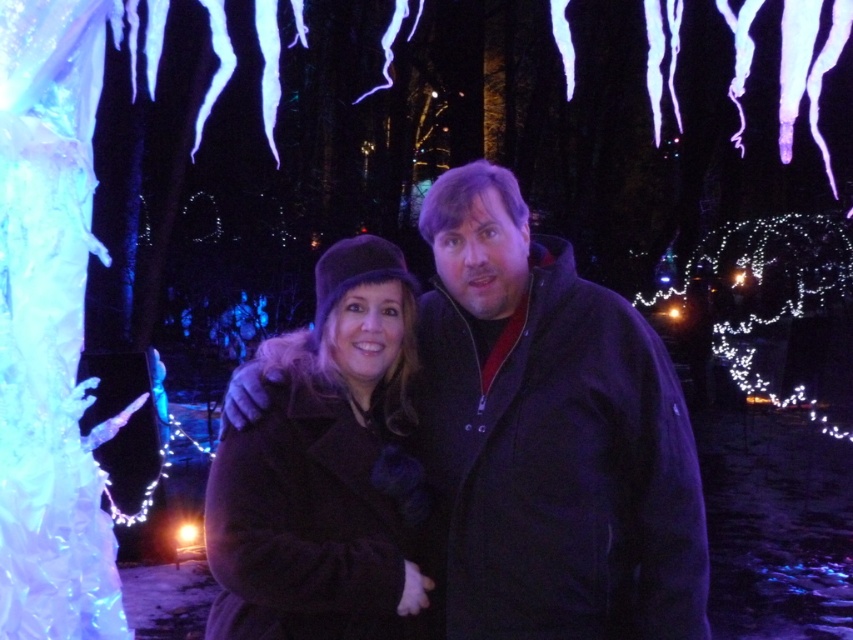
In the scene shown: Is dark brown coat at center taller than velvet black coat at center?

Correct, dark brown coat at center is much taller as velvet black coat at center.

In the scene shown: Can you confirm if dark brown coat at center is positioned below velvet black coat at center?

No.

Is point (639, 493) more distant than point (286, 333)?

No.

In order to click on dark brown coat at center in this screenshot , I will do `click(550, 435)`.